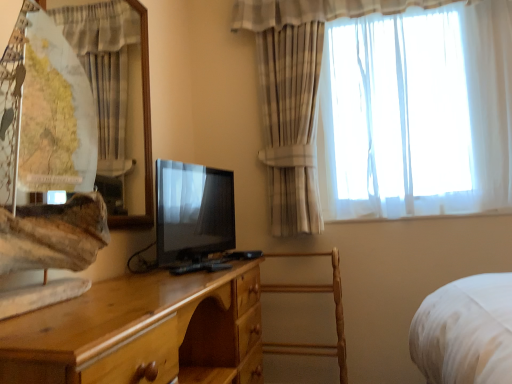
Question: Does wooden armchair at center appear on the right side of light brown wood chest of drawers at center?

Choices:
 (A) yes
 (B) no

Answer: (A)

Question: Does wooden armchair at center have a greater height compared to light brown wood chest of drawers at center?

Choices:
 (A) yes
 (B) no

Answer: (A)

Question: Is wooden armchair at center next to light brown wood chest of drawers at center and touching it?

Choices:
 (A) yes
 (B) no

Answer: (B)

Question: Can you confirm if wooden armchair at center is bigger than light brown wood chest of drawers at center?

Choices:
 (A) no
 (B) yes

Answer: (A)

Question: Considering the relative sizes of wooden armchair at center and light brown wood chest of drawers at center in the image provided, is wooden armchair at center shorter than light brown wood chest of drawers at center?

Choices:
 (A) no
 (B) yes

Answer: (A)

Question: Would you say matte black tv at center is inside or outside wooden armchair at center?

Choices:
 (A) inside
 (B) outside

Answer: (B)

Question: Does point (174, 256) appear closer or farther from the camera than point (339, 372)?

Choices:
 (A) closer
 (B) farther

Answer: (A)

Question: Is matte black tv at center to the left or to the right of wooden armchair at center in the image?

Choices:
 (A) left
 (B) right

Answer: (A)

Question: Considering the positions of matte black tv at center and wooden armchair at center in the image, is matte black tv at center taller or shorter than wooden armchair at center?

Choices:
 (A) short
 (B) tall

Answer: (A)

Question: Visually, is sheer white curtain at upper right, the second curtain from the left, positioned to the left or to the right of wooden armchair at center?

Choices:
 (A) left
 (B) right

Answer: (B)

Question: From the image's perspective, relative to wooden armchair at center, is sheer white curtain at upper right, marked as the 1th curtain in a right-to-left arrangement, above or below?

Choices:
 (A) above
 (B) below

Answer: (A)

Question: Does point (370, 84) appear closer or farther from the camera than point (332, 289)?

Choices:
 (A) farther
 (B) closer

Answer: (A)

Question: Considering the positions of sheer white curtain at upper right, marked as the 1th curtain in a right-to-left arrangement, and wooden armchair at center in the image, is sheer white curtain at upper right, marked as the 1th curtain in a right-to-left arrangement, bigger or smaller than wooden armchair at center?

Choices:
 (A) big
 (B) small

Answer: (A)

Question: Is point (244, 8) closer or farther from the camera than point (206, 243)?

Choices:
 (A) farther
 (B) closer

Answer: (A)

Question: Would you say sheer white curtain at upper right, marked as the 1th curtain in a right-to-left arrangement, is inside or outside matte black tv at center?

Choices:
 (A) outside
 (B) inside

Answer: (A)